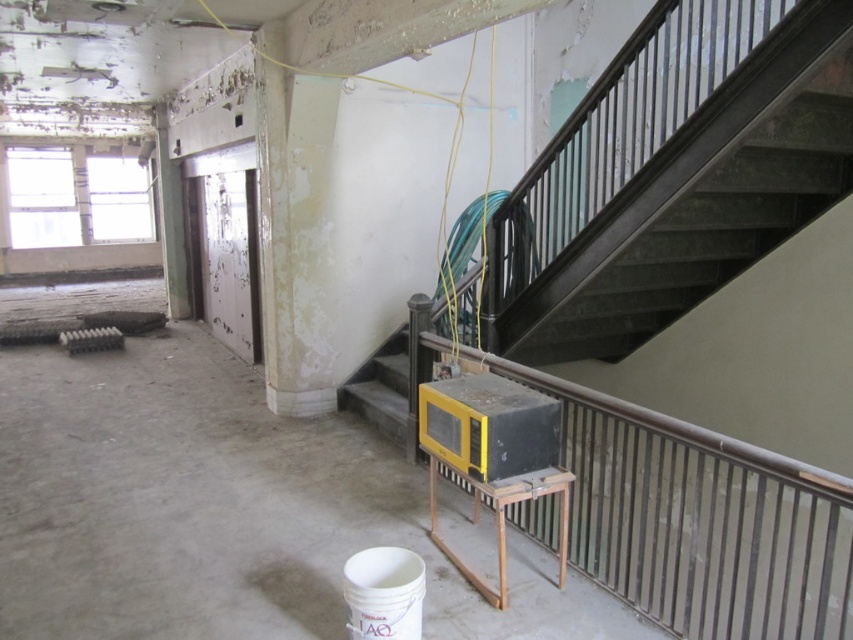
Is wooden stool at center positioned before yellow plastic stairwell at center?

Yes, wooden stool at center is in front of yellow plastic stairwell at center.

Does point (521, 481) lie behind point (364, 394)?

No, it is not.

Find the location of a particular element. wooden stool at center is located at coordinates (503, 518).